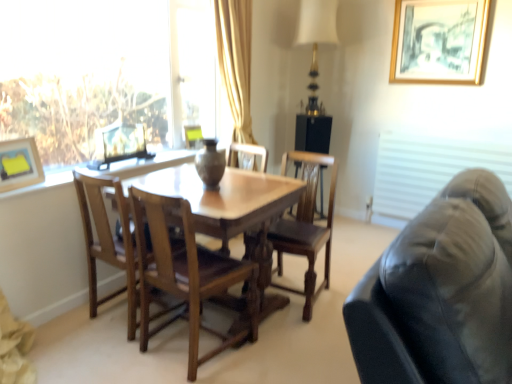
Question: From a real-world perspective, is matte yellow picture frame at upper left, which is counted as the third picture frame, starting from the top, physically above transparent glass window at upper left?

Choices:
 (A) yes
 (B) no

Answer: (B)

Question: Is matte yellow picture frame at upper left, which ranks as the first picture frame in left-to-right order, oriented away from transparent glass window at upper left?

Choices:
 (A) yes
 (B) no

Answer: (A)

Question: Is matte yellow picture frame at upper left, which is counted as the third picture frame, starting from the top, oriented towards transparent glass window at upper left?

Choices:
 (A) no
 (B) yes

Answer: (A)

Question: Does matte yellow picture frame at upper left, which appears as the first picture frame when ordered from the bottom, appear on the right side of transparent glass window at upper left?

Choices:
 (A) yes
 (B) no

Answer: (B)

Question: Does matte yellow picture frame at upper left, which ranks as the first picture frame in left-to-right order, come in front of transparent glass window at upper left?

Choices:
 (A) yes
 (B) no

Answer: (B)

Question: Based on their sizes in the image, would you say matte yellow picture frame at upper left, the first picture frame in the front-to-back sequence, is bigger or smaller than white fabric blind at right?

Choices:
 (A) small
 (B) big

Answer: (A)

Question: Would you say matte yellow picture frame at upper left, the first picture frame in the front-to-back sequence, is to the left or to the right of white fabric blind at right in the picture?

Choices:
 (A) left
 (B) right

Answer: (A)

Question: Considering their positions, is matte yellow picture frame at upper left, which appears as the first picture frame when ordered from the bottom, located in front of or behind white fabric blind at right?

Choices:
 (A) behind
 (B) front

Answer: (B)

Question: Is matte yellow picture frame at upper left, the third picture frame positioned from the back, situated inside white fabric blind at right or outside?

Choices:
 (A) outside
 (B) inside

Answer: (A)

Question: Is point (10, 173) positioned closer to the camera than point (210, 175)?

Choices:
 (A) farther
 (B) closer

Answer: (B)

Question: Is matte yellow picture frame at upper left, which appears as the first picture frame when ordered from the bottom, situated inside matte brown vase at center or outside?

Choices:
 (A) outside
 (B) inside

Answer: (A)

Question: Considering the positions of matte yellow picture frame at upper left, which appears as the first picture frame when ordered from the bottom, and matte brown vase at center in the image, is matte yellow picture frame at upper left, which appears as the first picture frame when ordered from the bottom, taller or shorter than matte brown vase at center?

Choices:
 (A) tall
 (B) short

Answer: (B)

Question: In the image, is matte yellow picture frame at upper left, which ranks as the first picture frame in left-to-right order, positioned in front of or behind matte brown vase at center?

Choices:
 (A) front
 (B) behind

Answer: (A)

Question: Looking at their shapes, would you say matte brown vase at center is wider or thinner than white fabric blind at right?

Choices:
 (A) thin
 (B) wide

Answer: (B)

Question: Is matte brown vase at center taller or shorter than white fabric blind at right?

Choices:
 (A) tall
 (B) short

Answer: (B)